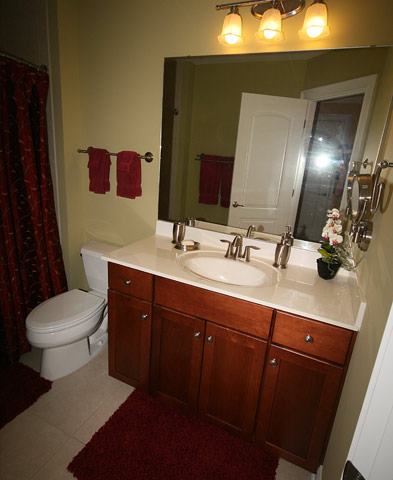
Locate an element on the screen. Image resolution: width=393 pixels, height=480 pixels. rug is located at coordinates (151, 426).